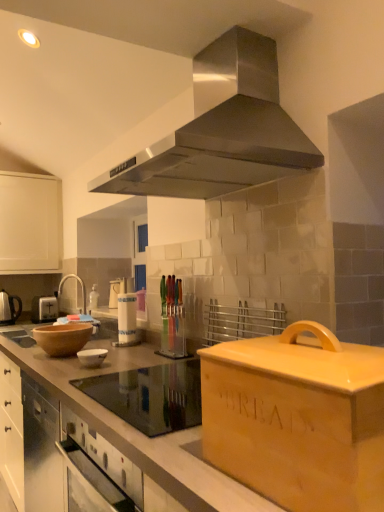
Question: Should I look upward or downward to see matte black kettle at left?

Choices:
 (A) down
 (B) up

Answer: (A)

Question: Does matte brown countertop at center, which ranks as the second countertop in back-to-front order, have a lesser width compared to white plastic toaster at left?

Choices:
 (A) no
 (B) yes

Answer: (A)

Question: Could white plastic toaster at left be considered to be inside matte brown countertop at center, which is counted as the 1th countertop, starting from the front?

Choices:
 (A) yes
 (B) no

Answer: (B)

Question: Can you confirm if matte brown countertop at center, which is counted as the 1th countertop, starting from the front, is shorter than white plastic toaster at left?

Choices:
 (A) yes
 (B) no

Answer: (B)

Question: Are matte brown countertop at center, which is counted as the 1th countertop, starting from the front, and white plastic toaster at left far apart?

Choices:
 (A) no
 (B) yes

Answer: (B)

Question: Is matte brown countertop at center, which ranks as the second countertop in back-to-front order, bigger than white plastic toaster at left?

Choices:
 (A) yes
 (B) no

Answer: (A)

Question: Considering the relative sizes of matte brown countertop at center, which ranks as the second countertop in back-to-front order, and white plastic toaster at left in the image provided, is matte brown countertop at center, which ranks as the second countertop in back-to-front order, smaller than white plastic toaster at left?

Choices:
 (A) yes
 (B) no

Answer: (B)

Question: Is white plastic toaster at left smaller than white glossy bowl at center?

Choices:
 (A) yes
 (B) no

Answer: (B)

Question: From the image's perspective, is white plastic toaster at left on top of white glossy bowl at center?

Choices:
 (A) no
 (B) yes

Answer: (A)

Question: Is white plastic toaster at left taller than white glossy bowl at center?

Choices:
 (A) no
 (B) yes

Answer: (B)

Question: Is white plastic toaster at left bigger than white glossy bowl at center?

Choices:
 (A) no
 (B) yes

Answer: (B)

Question: Is white plastic toaster at left closer to the viewer compared to white glossy bowl at center?

Choices:
 (A) no
 (B) yes

Answer: (A)

Question: Considering the relative sizes of white plastic toaster at left and white glossy bowl at center in the image provided, is white plastic toaster at left wider than white glossy bowl at center?

Choices:
 (A) no
 (B) yes

Answer: (B)

Question: Is the depth of brown wooden mixing bowl at left less than that of white plastic toaster at left?

Choices:
 (A) no
 (B) yes

Answer: (B)